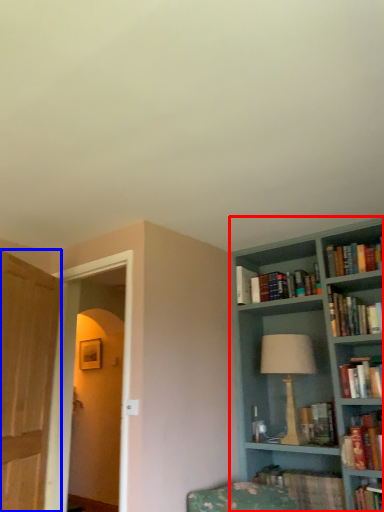
Question: Among these objects, which one is nearest to the camera, bookcase (highlighted by a red box) or glass door (highlighted by a blue box)?

Choices:
 (A) bookcase
 (B) glass door

Answer: (B)